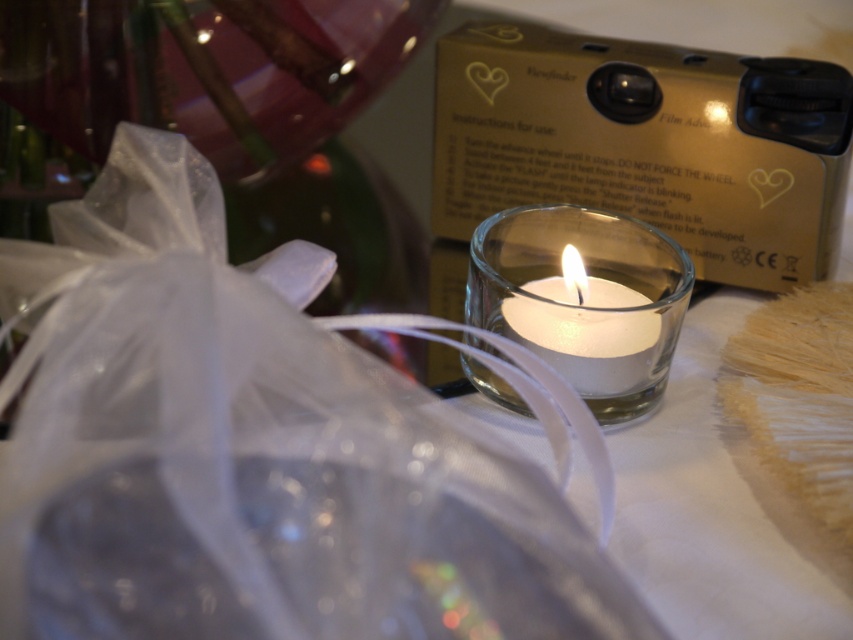
Question: Which point appears farthest from the camera in this image?

Choices:
 (A) (532, 221)
 (B) (572, 262)
 (C) (74, 484)

Answer: (A)

Question: Is white satin ribbon at center further to the viewer compared to white matte candle at center?

Choices:
 (A) yes
 (B) no

Answer: (B)

Question: Is transparent glass candle at center above white matte candle at center?

Choices:
 (A) no
 (B) yes

Answer: (B)

Question: Among these points, which one is farthest from the camera?

Choices:
 (A) coord(639,308)
 (B) coord(520,332)
 (C) coord(97,321)

Answer: (B)

Question: Which point is closer to the camera taking this photo?

Choices:
 (A) (635, 346)
 (B) (252, 305)
 (C) (602, 372)

Answer: (B)

Question: Can you confirm if white satin ribbon at center is positioned to the right of white matte candle at center?

Choices:
 (A) yes
 (B) no

Answer: (B)